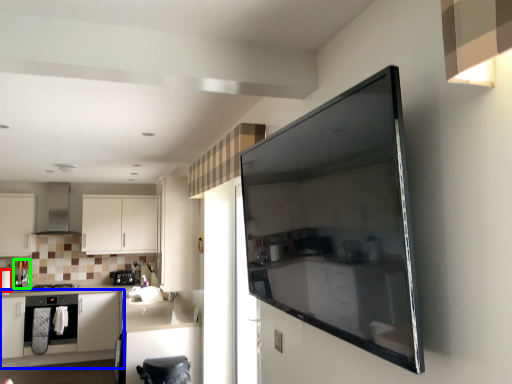
Question: Which object is positioned closest to appliance (highlighted by a red box)? Select from cabinetry (highlighted by a blue box) and appliance (highlighted by a green box).

Choices:
 (A) cabinetry
 (B) appliance

Answer: (B)